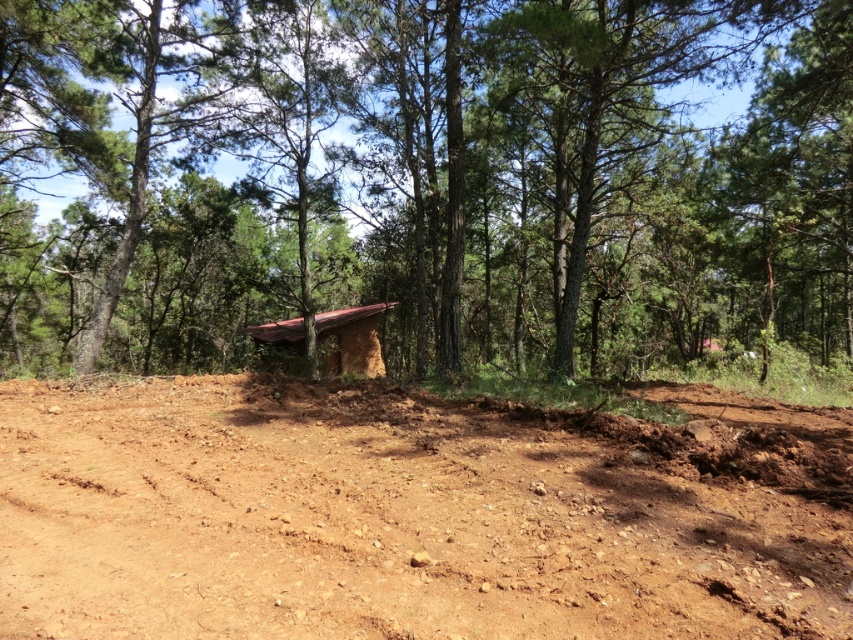
You are an architect designing a new eco lodge. You observe the brown textured hut at center and the brown mud hut at center in the image. Which one is more suitable for a taller building design?

The brown textured hut at center is taller than the brown mud hut at center, so it would be more suitable for a taller building design.

Looking at this image, you are a hiker who has just arrived at this rural area. You see the brown soil at center and the brown mud hut at center. Which one is higher in elevation?

The brown soil at center is above the brown mud hut at center, so the brown soil at center is higher in elevation.